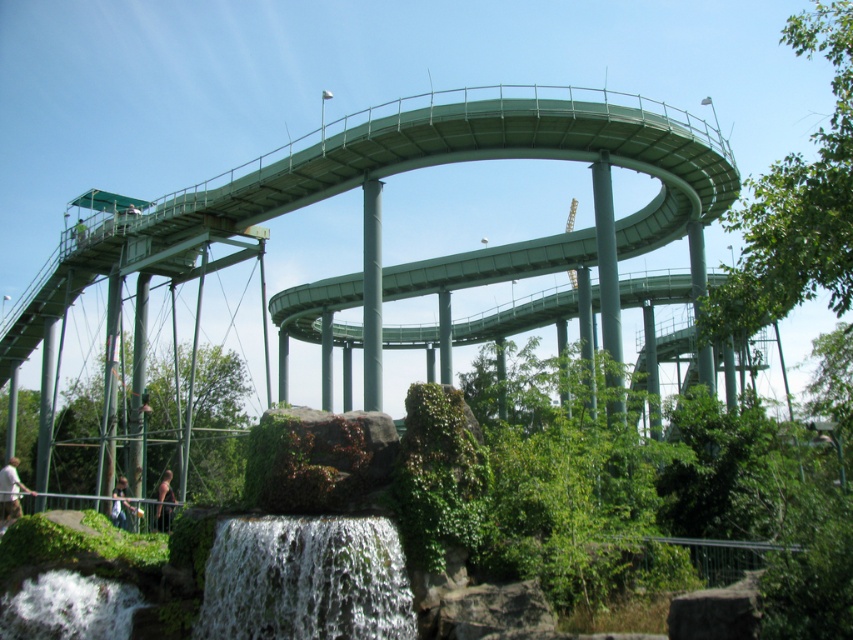
Question: Considering the real-world distances, which object is closest to the green metallic bridge at upper center?

Choices:
 (A) white fabric shirt at lower left
 (B) light brown hair at lower center
 (C) white frothy water at lower center

Answer: (B)

Question: Does green metallic bridge at upper center appear on the right side of white frothy water at lower center?

Choices:
 (A) yes
 (B) no

Answer: (B)

Question: Is white fabric shirt at lower left above light brown hair at lower center?

Choices:
 (A) no
 (B) yes

Answer: (A)

Question: From the image, what is the correct spatial relationship of green metallic bridge at upper center in relation to light brown hair at lower center?

Choices:
 (A) right
 (B) left

Answer: (A)

Question: Which object is closer to the camera taking this photo?

Choices:
 (A) green metallic bridge at upper center
 (B) dark brown leather jacket at lower center

Answer: (A)

Question: Which of these objects is positioned closest to the white frothy water at lower center?

Choices:
 (A) light brown hair at lower center
 (B) white fabric shirt at lower left
 (C) green metallic bridge at upper center
 (D) dark brown leather jacket at lower center

Answer: (D)